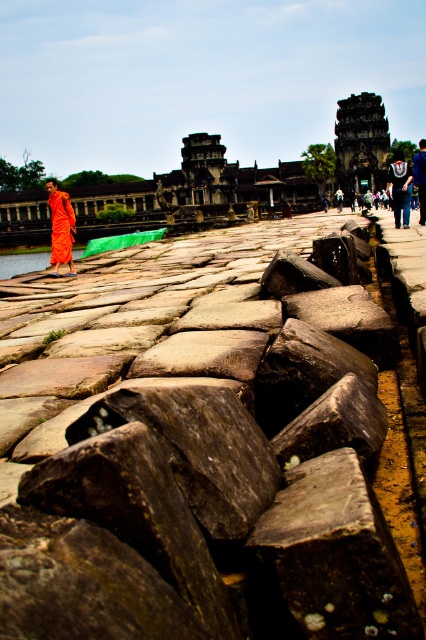
You are standing at the viewpoint of the image and want to reach the point labeled as point [422,157]. Is the point labeled as point [111,387] in your way?

Yes, the point [111,387] is closer to you than point [422,157], so it is in your path.

You are a tourist visiting Angkor Wat and want to take a photo of the orange cloth monk at center standing next to the brown rough stone at left. Based on their sizes, will the monk fit comfortably in the frame with the stone?

The brown rough stone at left is bigger than orange cloth monk at center. Since the stone is larger, the monk can stand next to it comfortably in the photo frame without any issues.